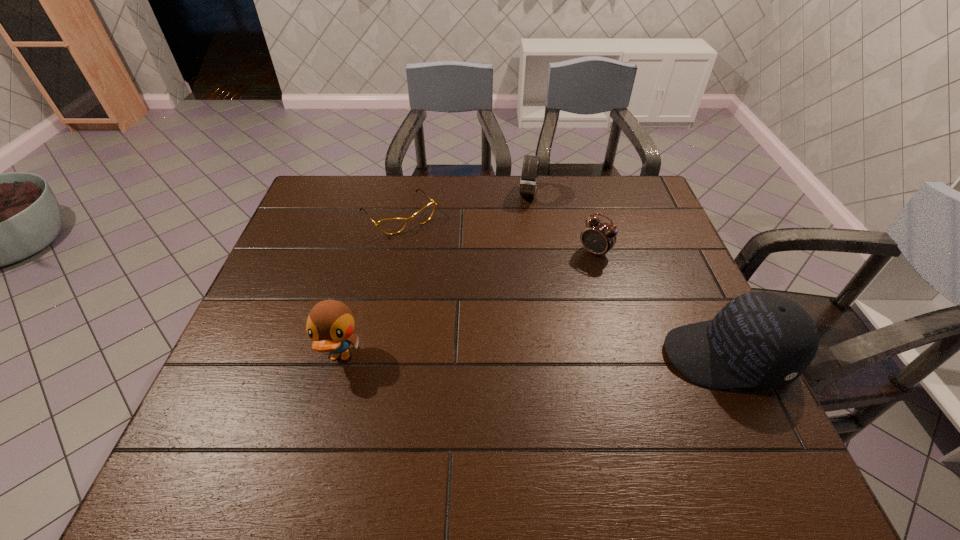
Locate an element on the screen. This screenshot has height=540, width=960. free space located on the front-facing side of the spectacles is located at coordinates (429, 249).

Find the location of a particular element. vacant region located on the front-facing side of the spectacles is located at coordinates (463, 290).

You are a GUI agent. You are given a task and a screenshot of the screen. Output one action in this format:
    pyautogui.click(x=<x>, y=<y>)
    Task: Click on the vacant position located on the face of the third object from left to right
    The image size is (960, 540).
    Given the screenshot: What is the action you would take?
    pyautogui.click(x=522, y=233)

Image resolution: width=960 pixels, height=540 pixels. I want to click on vacant space situated 0.090m on the face of the third object from left to right, so click(524, 223).

Locate an element on the screen. This screenshot has width=960, height=540. free point located 0.290m on the face of the third object from left to right is located at coordinates (516, 267).

The image size is (960, 540). Find the location of `free point located on the face of the second object from right to left`. free point located on the face of the second object from right to left is located at coordinates (512, 338).

This screenshot has height=540, width=960. In order to click on vacant area situated on the face of the second object from right to left in this screenshot , I will do `click(569, 278)`.

This screenshot has width=960, height=540. Identify the location of free space located 0.060m on the face of the second object from right to left. (575, 272).

The image size is (960, 540). I want to click on spectacles that is positioned at the far edge, so click(x=392, y=225).

This screenshot has width=960, height=540. I want to click on watch that is positioned at the far edge, so click(528, 182).